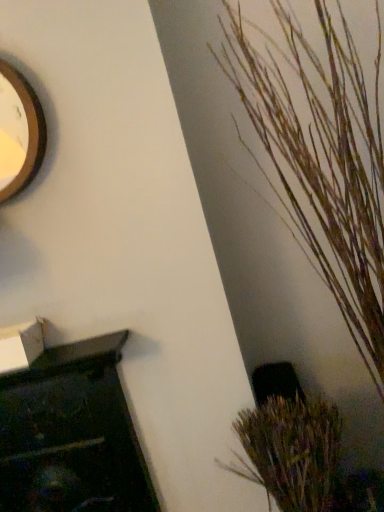
I want to click on brown textured plant at lower right, the first houseplant from the bottom, so click(302, 458).

At what (x,y) coordinates should I click in order to perform the action: click on brown textured plant at lower right, the first houseplant from the bottom. Please return your answer as a coordinate pair (x, y). The image size is (384, 512). Looking at the image, I should click on (302, 458).

Does wooden textured plant at right, which ranks as the 2th houseplant in bottom-to-top order, lie behind brown textured plant at lower right, the first houseplant from the bottom?

No, the depth of wooden textured plant at right, which ranks as the 2th houseplant in bottom-to-top order, is less than that of brown textured plant at lower right, the first houseplant from the bottom.

Which of these two, wooden textured plant at right, acting as the first houseplant starting from the top, or brown textured plant at lower right, the first houseplant from the bottom, is thinner?

brown textured plant at lower right, the first houseplant from the bottom.

Is wooden textured plant at right, acting as the first houseplant starting from the top, outside of brown textured plant at lower right, which appears as the 2th houseplant when viewed from the top?

wooden textured plant at right, acting as the first houseplant starting from the top, is positioned outside brown textured plant at lower right, which appears as the 2th houseplant when viewed from the top.

Considering the sizes of objects wooden clock at upper left and brown textured plant at lower right, the first houseplant from the bottom, in the image provided, who is shorter, wooden clock at upper left or brown textured plant at lower right, the first houseplant from the bottom,?

wooden clock at upper left is shorter.

Are wooden clock at upper left and brown textured plant at lower right, which appears as the 2th houseplant when viewed from the top, beside each other?

No, wooden clock at upper left is not touching brown textured plant at lower right, which appears as the 2th houseplant when viewed from the top.

Locate an element on the screen. clock above the brown textured plant at lower right, which appears as the 2th houseplant when viewed from the top (from the image's perspective) is located at coordinates (19, 132).

From the image's perspective, between wooden clock at upper left and brown textured plant at lower right, the first houseplant from the bottom, which one is located above?

wooden clock at upper left, from the image's perspective.

Based on the photo, is brown textured plant at lower right, the first houseplant from the bottom, oriented away from wooden clock at upper left?

That's not correct — brown textured plant at lower right, the first houseplant from the bottom, is not looking away from wooden clock at upper left.

Between brown textured plant at lower right, which appears as the 2th houseplant when viewed from the top, and wooden clock at upper left, which one is positioned behind?

wooden clock at upper left is further from the camera.

Consider the image. How different are the orientations of brown textured plant at lower right, which appears as the 2th houseplant when viewed from the top, and wooden clock at upper left in degrees?

0.424 degrees separate the facing orientations of brown textured plant at lower right, which appears as the 2th houseplant when viewed from the top, and wooden clock at upper left.

Is brown textured plant at lower right, which appears as the 2th houseplant when viewed from the top, shorter than wooden clock at upper left?

Incorrect, the height of brown textured plant at lower right, which appears as the 2th houseplant when viewed from the top, does not fall short of that of wooden clock at upper left.

From the image's perspective, which one is positioned lower, wooden clock at upper left or wooden textured plant at right, acting as the first houseplant starting from the top?

wooden textured plant at right, acting as the first houseplant starting from the top, is shown below in the image.

In the scene shown: Visually, is wooden clock at upper left positioned to the left or to the right of wooden textured plant at right, which ranks as the 2th houseplant in bottom-to-top order?

wooden clock at upper left is positioned on wooden textured plant at right, which ranks as the 2th houseplant in bottom-to-top order,'s left side.

From a real-world perspective, is wooden clock at upper left under wooden textured plant at right, acting as the first houseplant starting from the top?

Incorrect, from a real-world perspective, wooden clock at upper left is higher than wooden textured plant at right, acting as the first houseplant starting from the top.

Between brown textured plant at lower right, which appears as the 2th houseplant when viewed from the top, and wooden textured plant at right, which ranks as the 2th houseplant in bottom-to-top order, which one has smaller width?

brown textured plant at lower right, which appears as the 2th houseplant when viewed from the top, is thinner.

Measure the distance from brown textured plant at lower right, which appears as the 2th houseplant when viewed from the top, to wooden textured plant at right, which ranks as the 2th houseplant in bottom-to-top order.

A distance of 26.22 inches exists between brown textured plant at lower right, which appears as the 2th houseplant when viewed from the top, and wooden textured plant at right, which ranks as the 2th houseplant in bottom-to-top order.

Is brown textured plant at lower right, which appears as the 2th houseplant when viewed from the top, touching wooden textured plant at right, acting as the first houseplant starting from the top?

brown textured plant at lower right, which appears as the 2th houseplant when viewed from the top, is not next to wooden textured plant at right, acting as the first houseplant starting from the top, and they're not touching.

Is brown textured plant at lower right, which appears as the 2th houseplant when viewed from the top, turned away from wooden textured plant at right, acting as the first houseplant starting from the top?

brown textured plant at lower right, which appears as the 2th houseplant when viewed from the top, does not have its back to wooden textured plant at right, acting as the first houseplant starting from the top.

Between wooden textured plant at right, acting as the first houseplant starting from the top, and wooden clock at upper left, which one has more height?

wooden textured plant at right, acting as the first houseplant starting from the top, is taller.

Is the position of wooden textured plant at right, which ranks as the 2th houseplant in bottom-to-top order, more distant than that of wooden clock at upper left?

That is False.

From a real-world perspective, is wooden textured plant at right, acting as the first houseplant starting from the top, physically located above or below wooden clock at upper left?

From a real-world perspective, wooden textured plant at right, acting as the first houseplant starting from the top, is physically below wooden clock at upper left.

Would you say wooden textured plant at right, which ranks as the 2th houseplant in bottom-to-top order, is to the left or to the right of wooden clock at upper left in the picture?

Based on their positions, wooden textured plant at right, which ranks as the 2th houseplant in bottom-to-top order, is located to the right of wooden clock at upper left.

Locate an element on the screen. Image resolution: width=384 pixels, height=512 pixels. houseplant lying behind the wooden textured plant at right, acting as the first houseplant starting from the top is located at coordinates (302, 458).

Locate an element on the screen. The height and width of the screenshot is (512, 384). clock positioned vertically above the brown textured plant at lower right, which appears as the 2th houseplant when viewed from the top (from a real-world perspective) is located at coordinates click(19, 132).

From the image, which object appears to be farther from brown textured plant at lower right, the first houseplant from the bottom, wooden textured plant at right, acting as the first houseplant starting from the top, or wooden clock at upper left?

wooden clock at upper left lies further to brown textured plant at lower right, the first houseplant from the bottom, than the other object.

Considering their positions, is wooden clock at upper left positioned further to wooden textured plant at right, which ranks as the 2th houseplant in bottom-to-top order, than brown textured plant at lower right, which appears as the 2th houseplant when viewed from the top?

Based on the image, wooden clock at upper left appears to be further to wooden textured plant at right, which ranks as the 2th houseplant in bottom-to-top order.

Considering their positions, is brown textured plant at lower right, the first houseplant from the bottom, positioned further to wooden textured plant at right, which ranks as the 2th houseplant in bottom-to-top order, than wooden clock at upper left?

wooden clock at upper left is further to wooden textured plant at right, which ranks as the 2th houseplant in bottom-to-top order.

Estimate the real-world distances between objects in this image. Which object is closer to brown textured plant at lower right, the first houseplant from the bottom, wooden clock at upper left or wooden textured plant at right, which ranks as the 2th houseplant in bottom-to-top order?

wooden textured plant at right, which ranks as the 2th houseplant in bottom-to-top order, lies closer to brown textured plant at lower right, the first houseplant from the bottom, than the other object.

Considering their positions, is wooden textured plant at right, which ranks as the 2th houseplant in bottom-to-top order, positioned closer to wooden clock at upper left than brown textured plant at lower right, the first houseplant from the bottom?

The object closer to wooden clock at upper left is wooden textured plant at right, which ranks as the 2th houseplant in bottom-to-top order.

Estimate the real-world distances between objects in this image. Which object is closer to wooden clock at upper left, brown textured plant at lower right, the first houseplant from the bottom, or wooden textured plant at right, which ranks as the 2th houseplant in bottom-to-top order?

wooden textured plant at right, which ranks as the 2th houseplant in bottom-to-top order.

The height and width of the screenshot is (512, 384). What are the coordinates of `houseplant between wooden clock at upper left and wooden textured plant at right, acting as the first houseplant starting from the top, in the horizontal direction` in the screenshot? It's located at (302, 458).